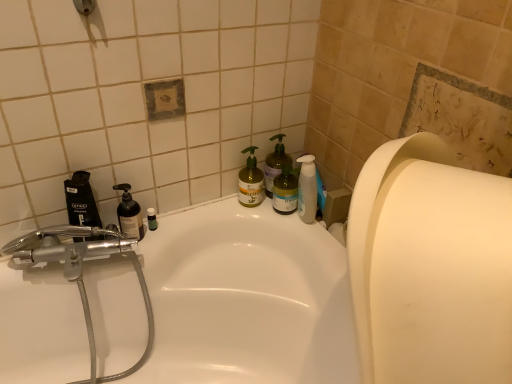
The height and width of the screenshot is (384, 512). Identify the location of empty space that is in between matte black pump bottle at left, the third cleaning product from the right, and green matte bottle at center, the second cleaning product viewed from the right. (193, 221).